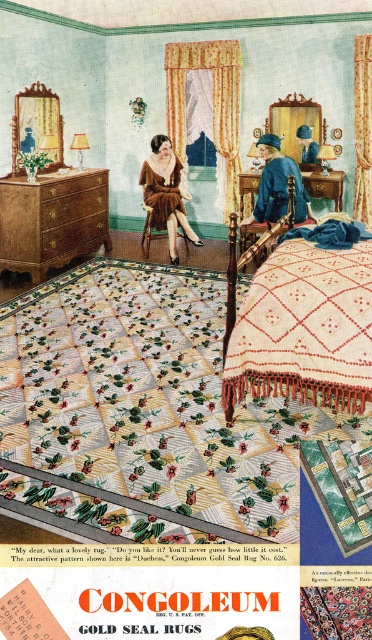
You are organizing a closet and see the white knitted blanket at center and the fuzzy brown fur coat at center. Which item is on top of the other?

The fuzzy brown fur coat at center is on top of the white knitted blanket at center because the white knitted blanket at center is positioned under the fuzzy brown fur coat at center.

You are organizing a small gathering in the bedroom depicted in the image. You need to place a decorative pillow between the white knitted blanket at center and the fuzzy brown fur coat at center. Since both items are at the center, which one should you place the pillow closer to to ensure it fits within the available space?

You should place the decorative pillow closer to the fuzzy brown fur coat at center because the white knitted blanket at center is wider, leaving less space between them. The pillow should be positioned near the narrower item to accommodate the space.

You are standing in the vintage Congoleum Gold Seal Rugs advertisement bedroom scene. You see two points marked in the image. Which point is closer to you, point at [255,416] or point at [279,140]?

Point at [255,416] is closer to you because it is in front of point at [279,140] according to the spatial arrangement in the image.